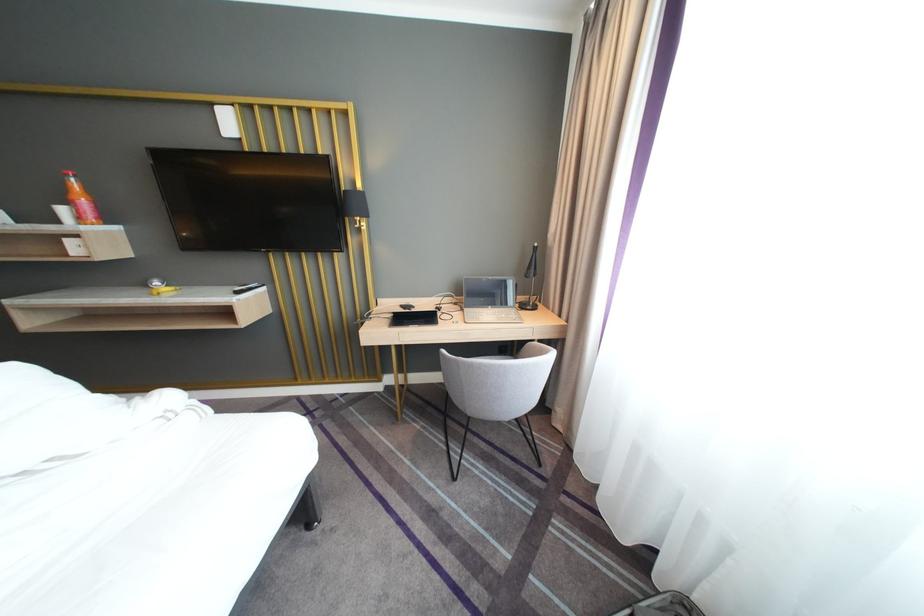
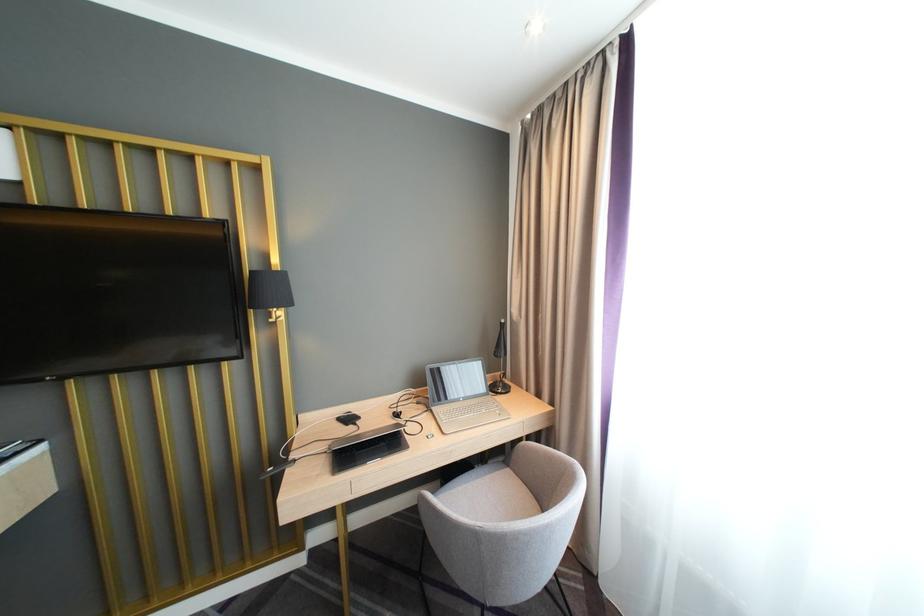
Question: Based on the continuous images, in which direction is the camera rotating? Reply with the corresponding letter.

Choices:
 (A) Left
 (B) Right
 (C) Up
 (D) Down

Answer: (B)